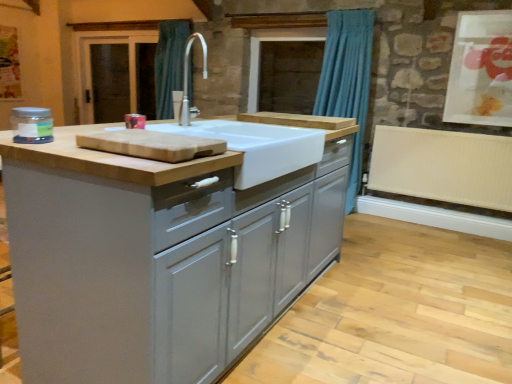
Question: Considering the relative positions of white ribbed radiator at lower right and brown wooden screen door at left in the image provided, is white ribbed radiator at lower right to the left of brown wooden screen door at left from the viewer's perspective?

Choices:
 (A) yes
 (B) no

Answer: (B)

Question: Can you confirm if white ribbed radiator at lower right is bigger than brown wooden screen door at left?

Choices:
 (A) yes
 (B) no

Answer: (A)

Question: Could you tell me if white ribbed radiator at lower right is turned towards brown wooden screen door at left?

Choices:
 (A) no
 (B) yes

Answer: (A)

Question: Is white ribbed radiator at lower right closer to the viewer compared to brown wooden screen door at left?

Choices:
 (A) yes
 (B) no

Answer: (A)

Question: Is white ribbed radiator at lower right placed right next to brown wooden screen door at left?

Choices:
 (A) no
 (B) yes

Answer: (A)

Question: From a real-world perspective, is matte glass jar at left physically located above or below brown wooden screen door at left?

Choices:
 (A) below
 (B) above

Answer: (A)

Question: From the image's perspective, is matte glass jar at left positioned above or below brown wooden screen door at left?

Choices:
 (A) above
 (B) below

Answer: (B)

Question: Choose the correct answer: Is matte glass jar at left inside brown wooden screen door at left or outside it?

Choices:
 (A) outside
 (B) inside

Answer: (A)

Question: Looking at the image, does matte glass jar at left seem bigger or smaller compared to brown wooden screen door at left?

Choices:
 (A) big
 (B) small

Answer: (B)

Question: Does point (123, 84) appear closer or farther from the camera than point (507, 84)?

Choices:
 (A) farther
 (B) closer

Answer: (A)

Question: Considering the positions of brown wooden screen door at left and matte paper artwork at upper right in the image, is brown wooden screen door at left bigger or smaller than matte paper artwork at upper right?

Choices:
 (A) big
 (B) small

Answer: (A)

Question: Is brown wooden screen door at left inside or outside of matte paper artwork at upper right?

Choices:
 (A) outside
 (B) inside

Answer: (A)

Question: From their relative heights in the image, would you say brown wooden screen door at left is taller or shorter than matte paper artwork at upper right?

Choices:
 (A) short
 (B) tall

Answer: (B)

Question: From the image's perspective, is blue fabric curtain at upper center located above or below matte gray cabinets at center?

Choices:
 (A) above
 (B) below

Answer: (A)

Question: Choose the correct answer: Is blue fabric curtain at upper center inside matte gray cabinets at center or outside it?

Choices:
 (A) outside
 (B) inside

Answer: (A)